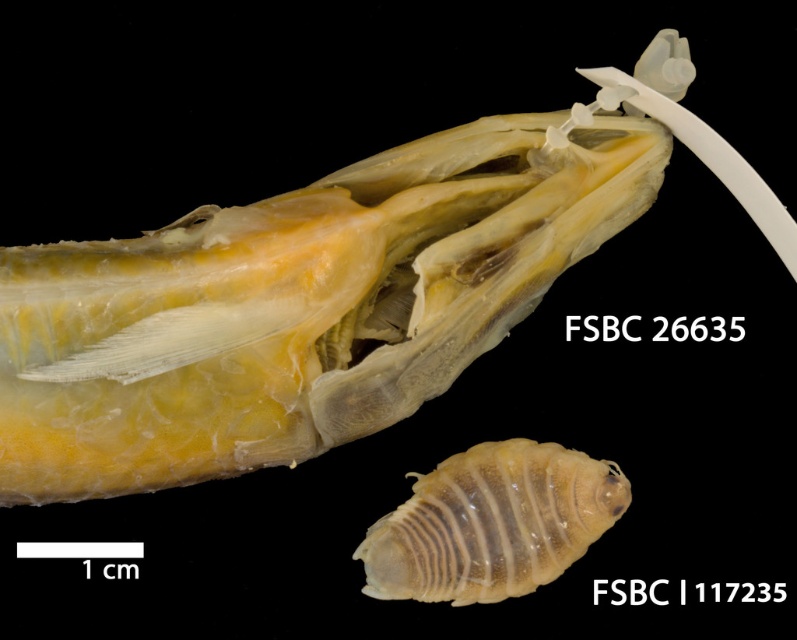
Can you confirm if translucent yellowish flesh at center is thinner than translucent yellowish-white at upper right?

In fact, translucent yellowish flesh at center might be wider than translucent yellowish-white at upper right.

Can you confirm if translucent yellowish flesh at center is bigger than translucent yellowish-white at upper right?

Yes.

Between point (512, 298) and point (383, 561), which one is positioned in front?

Point (383, 561) is in front.

This screenshot has width=797, height=640. I want to click on translucent yellowish flesh at center, so click(297, 305).